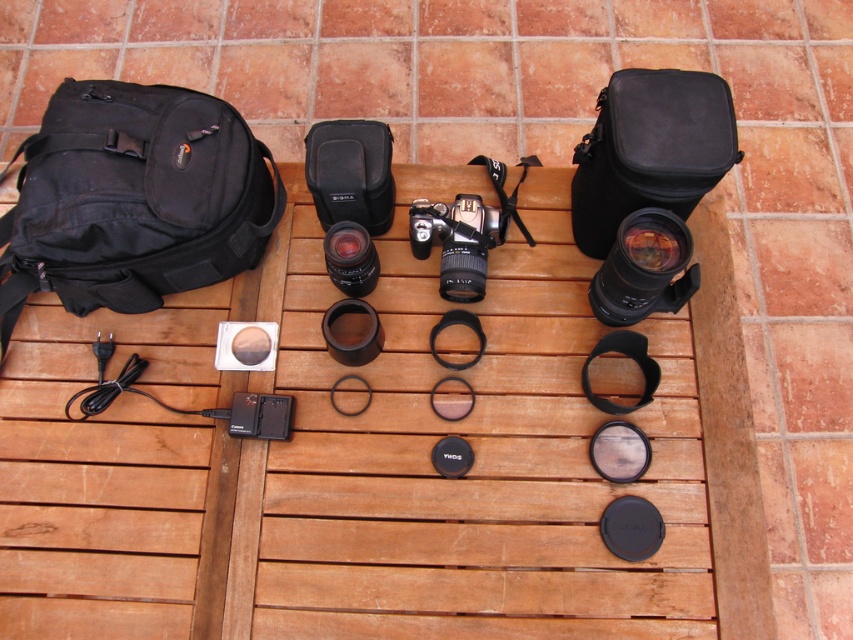
You are organizing your photography gear and need to place the black fabric backpack at upper left and the black fabric camera bag at upper right into a storage bin. The bin has a width of 40 cm. If the backpack is wider than the camera bag, can both items fit side by side in the bin without overlapping?

The black fabric backpack at upper left is wider than the black fabric camera bag at upper right. Since the backpack is wider, if the combined width of both items exceeds 40 cm, they won